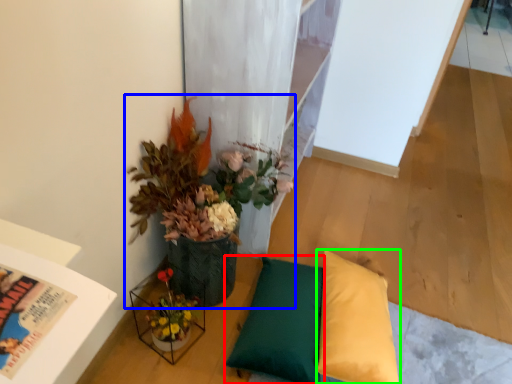
Question: Which is farther away from pillow (highlighted by a red box)? houseplant (highlighted by a blue box) or pillow (highlighted by a green box)?

Choices:
 (A) houseplant
 (B) pillow

Answer: (A)